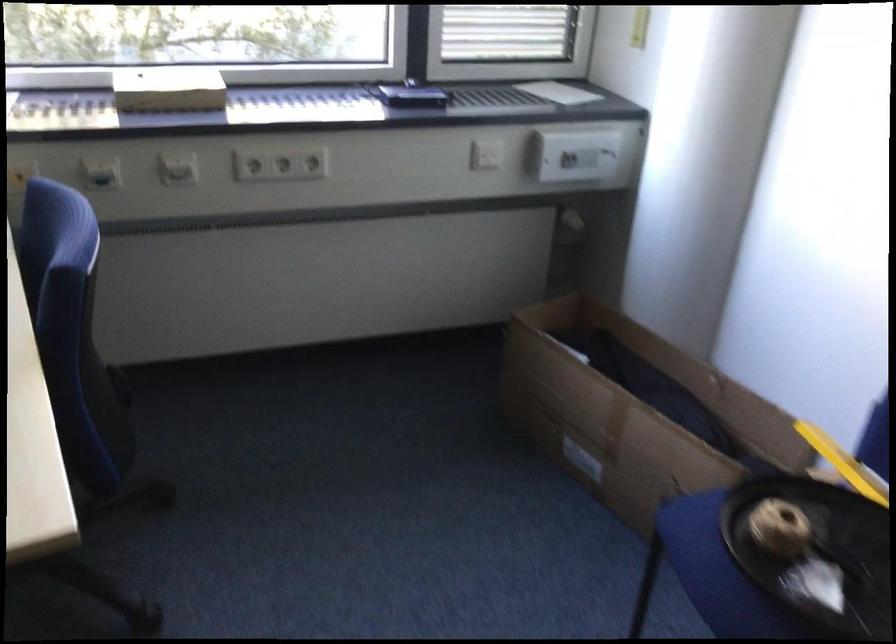
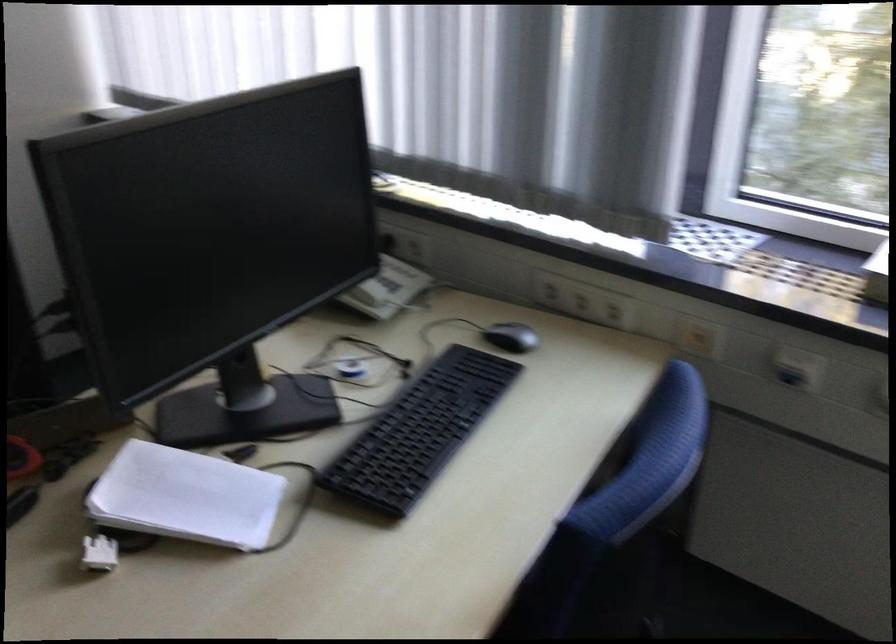
Question: The camera is either moving clockwise (left) or counter-clockwise (right) around the object. The first image is from the beginning of the video and the second image is from the end. Is the camera moving left or right when shooting the video?

Choices:
 (A) Left
 (B) Right

Answer: (B)